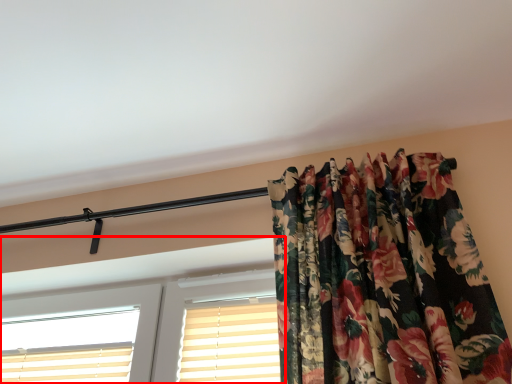
Question: In this image, where is window (annotated by the red box) located relative to shutter?

Choices:
 (A) right
 (B) left

Answer: (B)